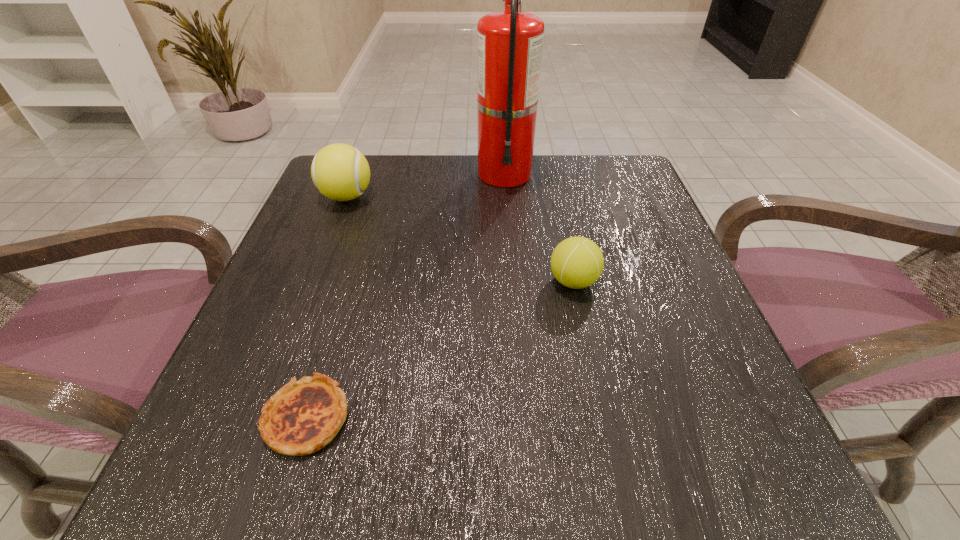
The image size is (960, 540). Find the location of `vacant region between the second shortest object and the third shortest object`. vacant region between the second shortest object and the third shortest object is located at coordinates (460, 239).

You are a GUI agent. You are given a task and a screenshot of the screen. Output one action in this format:
    pyautogui.click(x=<x>, y=<y>)
    Task: Click on the vacant space that is in between the fire extinguisher and the nearer tennis ball
    The image size is (960, 540).
    Given the screenshot: What is the action you would take?
    pyautogui.click(x=539, y=227)

Identify the location of free area in between the tallest object and the second nearest object. (539, 227).

Locate an element on the screen. empty location between the left tennis ball and the shortest object is located at coordinates (326, 307).

Identify the location of empty space between the nearer tennis ball and the fire extinguisher. (539, 227).

Locate which object is the closest to the nearest object. Please provide its 2D coordinates. Your answer should be formatted as a tuple, i.e. [(x, y)], where the tuple contains the x and y coordinates of a point satisfying the conditions above.

[(577, 262)]

Point out which object is positioned as the nearest to the second shortest object. Please provide its 2D coordinates. Your answer should be formatted as a tuple, i.e. [(x, y)], where the tuple contains the x and y coordinates of a point satisfying the conditions above.

[(509, 43)]

Find the location of `free spot that satisfies the following two spatial constraints: 1. at the nozzle of the fire extinguisher; 2. on the right side of the shorter tennis ball`. free spot that satisfies the following two spatial constraints: 1. at the nozzle of the fire extinguisher; 2. on the right side of the shorter tennis ball is located at coordinates pyautogui.click(x=513, y=281).

The height and width of the screenshot is (540, 960). Identify the location of vacant space that satisfies the following two spatial constraints: 1. on the back side of the second nearest object; 2. on the right side of the quiche. (348, 281).

Find the location of a particular element. Image resolution: width=960 pixels, height=540 pixels. vacant area in the image that satisfies the following two spatial constraints: 1. on the back side of the shortest object; 2. on the right side of the shorter tennis ball is located at coordinates (348, 281).